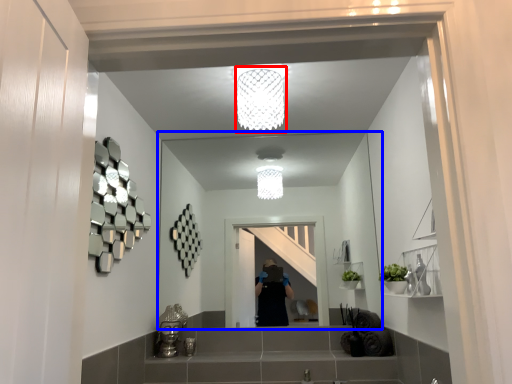
Question: Which object appears farthest to the camera in this image, light fixture (highlighted by a red box) or mirror (highlighted by a blue box)?

Choices:
 (A) light fixture
 (B) mirror

Answer: (B)